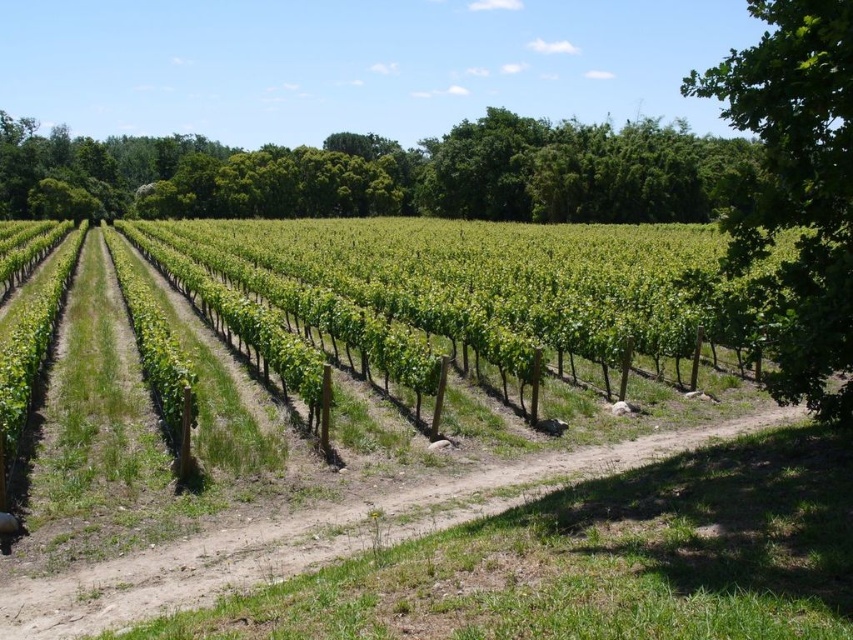
Question: Is green leafy tree at upper right to the right of dirt path at lower center from the viewer's perspective?

Choices:
 (A) yes
 (B) no

Answer: (B)

Question: Which is nearer to the green leafy tree at right?

Choices:
 (A) dirt path at lower center
 (B) green leafy tree at upper right

Answer: (A)

Question: Among these points, which one is farthest from the camera?

Choices:
 (A) (511, 504)
 (B) (763, 68)
 (C) (521, 140)

Answer: (C)

Question: Can you confirm if green leafy tree at upper right is wider than dirt path at lower center?

Choices:
 (A) no
 (B) yes

Answer: (B)

Question: Does green leafy tree at upper right appear on the left side of green leafy tree at right?

Choices:
 (A) no
 (B) yes

Answer: (B)

Question: Which object appears farthest from the camera in this image?

Choices:
 (A) dirt path at lower center
 (B) green leafy tree at upper right

Answer: (B)